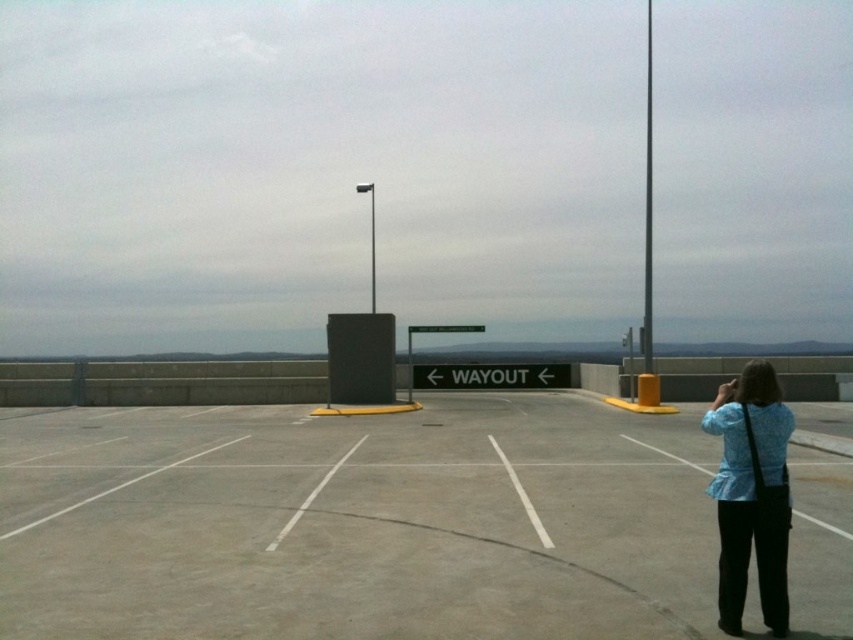
You are standing at point (x=773, y=605) and want to walk to point (x=567, y=577). Which direction should you move relative to your current position?

You should move forward because point (x=567, y=577) is behind point (x=773, y=605), meaning it is in the direction you are facing.

You are standing at the origin point of the coordinate system. You want to walk to the gray concrete parking lot at center. What are the coordinates you need to move to?

The coordinates for the gray concrete parking lot at center are at point (357, 522).